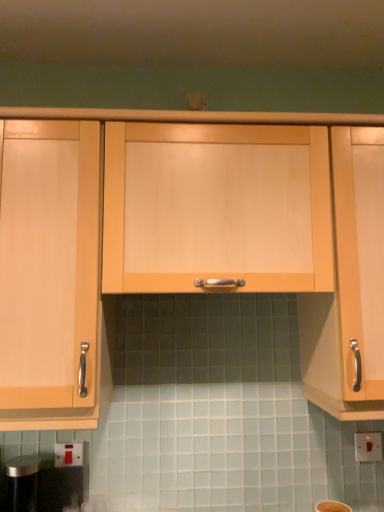
Question: Does white plastic switch at lower right, positioned as the 1th electric outlet in back-to-front order, appear on the right side of matte white electric outlet at lower left, which is the second electric outlet from back to front?

Choices:
 (A) no
 (B) yes

Answer: (B)

Question: Would you say white plastic switch at lower right, positioned as the 1th electric outlet in back-to-front order, is outside matte white electric outlet at lower left, the first electric outlet in the front-to-back sequence?

Choices:
 (A) yes
 (B) no

Answer: (A)

Question: From a real-world perspective, is white plastic switch at lower right, which is the second electric outlet in left-to-right order, on top of matte white electric outlet at lower left, placed as the second electric outlet when sorted from right to left?

Choices:
 (A) yes
 (B) no

Answer: (B)

Question: Is white plastic switch at lower right, positioned as the 1th electric outlet in back-to-front order, next to matte white electric outlet at lower left, which is the 1th electric outlet in left-to-right order?

Choices:
 (A) no
 (B) yes

Answer: (A)

Question: Does white plastic switch at lower right, arranged as the 1th electric outlet when viewed from the right, have a larger size compared to matte white electric outlet at lower left, which is the 1th electric outlet in left-to-right order?

Choices:
 (A) no
 (B) yes

Answer: (A)

Question: Can matte white electric outlet at lower left, which is the 1th electric outlet in left-to-right order, be found inside white plastic switch at lower right, arranged as the 1th electric outlet when viewed from the right?

Choices:
 (A) no
 (B) yes

Answer: (A)

Question: Can you confirm if matte white electric outlet at lower left, which is the 1th electric outlet in left-to-right order, is thinner than light wood cabinet at center, which ranks as the second cabinetry in right-to-left order?

Choices:
 (A) yes
 (B) no

Answer: (A)

Question: Is matte white electric outlet at lower left, placed as the second electric outlet when sorted from right to left, next to light wood cabinet at center, which ranks as the second cabinetry in right-to-left order, and touching it?

Choices:
 (A) yes
 (B) no

Answer: (B)

Question: Does matte white electric outlet at lower left, which is the second electric outlet from back to front, have a smaller size compared to light wood cabinet at center, placed as the 2th cabinetry when sorted from left to right?

Choices:
 (A) no
 (B) yes

Answer: (B)

Question: From a real-world perspective, is matte white electric outlet at lower left, which is the 1th electric outlet in left-to-right order, physically below light wood cabinet at center, which ranks as the second cabinetry in right-to-left order?

Choices:
 (A) yes
 (B) no

Answer: (A)

Question: Can you confirm if matte white electric outlet at lower left, which is the 1th electric outlet in left-to-right order, is positioned to the left of light wood cabinet at center, which ranks as the second cabinetry in right-to-left order?

Choices:
 (A) yes
 (B) no

Answer: (A)

Question: Considering the relative sizes of matte white electric outlet at lower left, placed as the second electric outlet when sorted from right to left, and light wood cabinet at center, placed as the 2th cabinetry when sorted from left to right, in the image provided, is matte white electric outlet at lower left, placed as the second electric outlet when sorted from right to left, wider than light wood cabinet at center, placed as the 2th cabinetry when sorted from left to right,?

Choices:
 (A) no
 (B) yes

Answer: (A)

Question: Is light wood cabinet handle at right, arranged as the 3th cabinetry when viewed from the left, smaller than matte white electric outlet at lower left, which is the second electric outlet from back to front?

Choices:
 (A) yes
 (B) no

Answer: (B)